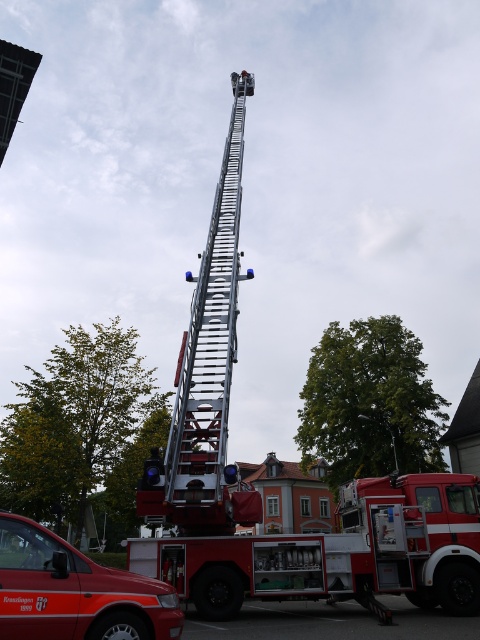
Question: Which of the following is the closest to the observer?

Choices:
 (A) (204, 337)
 (B) (122, 577)

Answer: (B)

Question: Is silver metallic ladder at upper center bigger than matte red van at lower left?

Choices:
 (A) no
 (B) yes

Answer: (B)

Question: Observing the image, what is the correct spatial positioning of metallic silver ladder at center in reference to silver metallic ladder at upper center?

Choices:
 (A) above
 (B) below

Answer: (B)

Question: Among these objects, which one is farthest from the camera?

Choices:
 (A) matte red van at lower left
 (B) metallic silver ladder at center

Answer: (B)

Question: Which of the following is the closest to the observer?

Choices:
 (A) silver metallic ladder at upper center
 (B) matte red van at lower left

Answer: (B)

Question: Does silver metallic ladder at upper center come in front of matte red van at lower left?

Choices:
 (A) yes
 (B) no

Answer: (B)